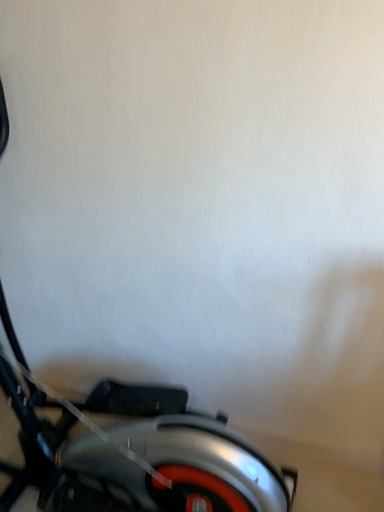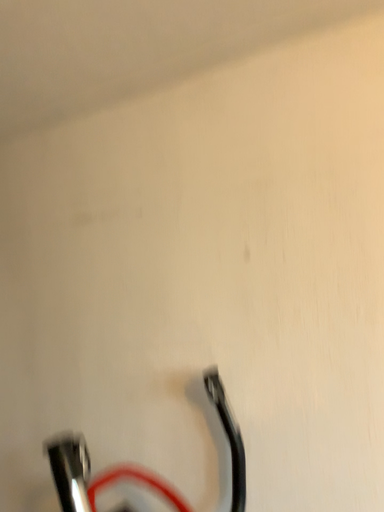
Question: Which way did the camera rotate in the video?

Choices:
 (A) rotated downward
 (B) rotated upward

Answer: (B)